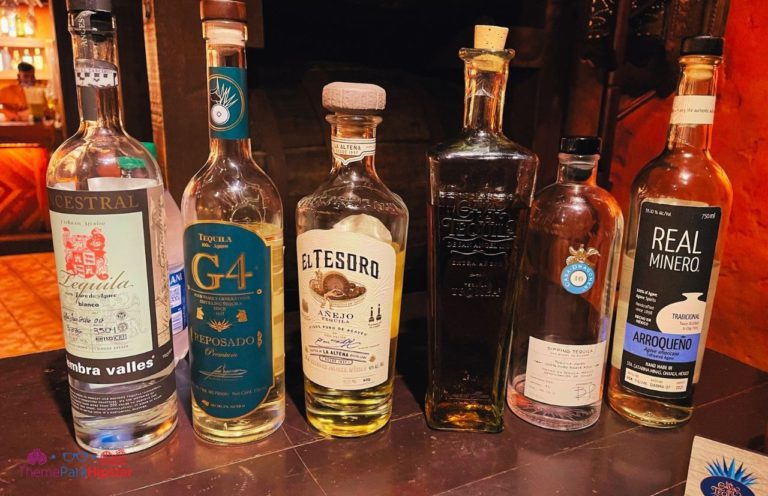
Image resolution: width=768 pixels, height=496 pixels. Find the location of `coaster`. coaster is located at coordinates tap(722, 482).